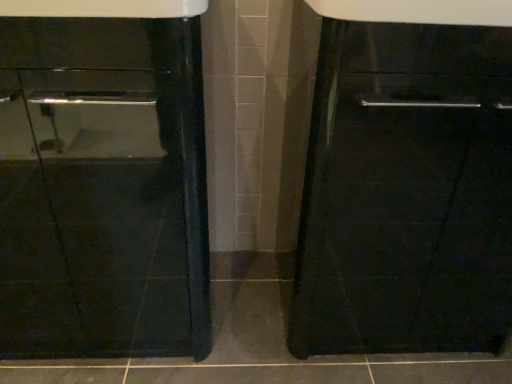
Question: Does glossy black sink at center contain glossy black cabinet at right?

Choices:
 (A) yes
 (B) no

Answer: (B)

Question: Could you tell me if glossy black sink at center is turned towards glossy black cabinet at right?

Choices:
 (A) yes
 (B) no

Answer: (B)

Question: Is glossy black sink at center not within glossy black cabinet at right?

Choices:
 (A) no
 (B) yes

Answer: (B)

Question: Does glossy black sink at center have a smaller size compared to glossy black cabinet at right?

Choices:
 (A) yes
 (B) no

Answer: (B)

Question: Is glossy black sink at center beside glossy black cabinet at right?

Choices:
 (A) yes
 (B) no

Answer: (B)

Question: Is glossy black sink at center bigger than glossy black cabinet at right?

Choices:
 (A) no
 (B) yes

Answer: (B)

Question: Is glossy black cabinet at right far away from glossy black sink at center?

Choices:
 (A) no
 (B) yes

Answer: (A)

Question: Considering the relative sizes of glossy black cabinet at right and glossy black sink at center in the image provided, is glossy black cabinet at right thinner than glossy black sink at center?

Choices:
 (A) yes
 (B) no

Answer: (A)

Question: Is glossy black sink at center at the back of glossy black cabinet at right?

Choices:
 (A) no
 (B) yes

Answer: (A)

Question: Is glossy black sink at center a part of glossy black cabinet at right?

Choices:
 (A) no
 (B) yes

Answer: (A)

Question: Considering the relative sizes of glossy black cabinet at right and glossy black sink at center in the image provided, is glossy black cabinet at right smaller than glossy black sink at center?

Choices:
 (A) no
 (B) yes

Answer: (B)

Question: Is glossy black cabinet at right at the right side of glossy black sink at center?

Choices:
 (A) no
 (B) yes

Answer: (B)

Question: In terms of height, does glossy black cabinet at right look taller or shorter compared to glossy black sink at center?

Choices:
 (A) tall
 (B) short

Answer: (B)